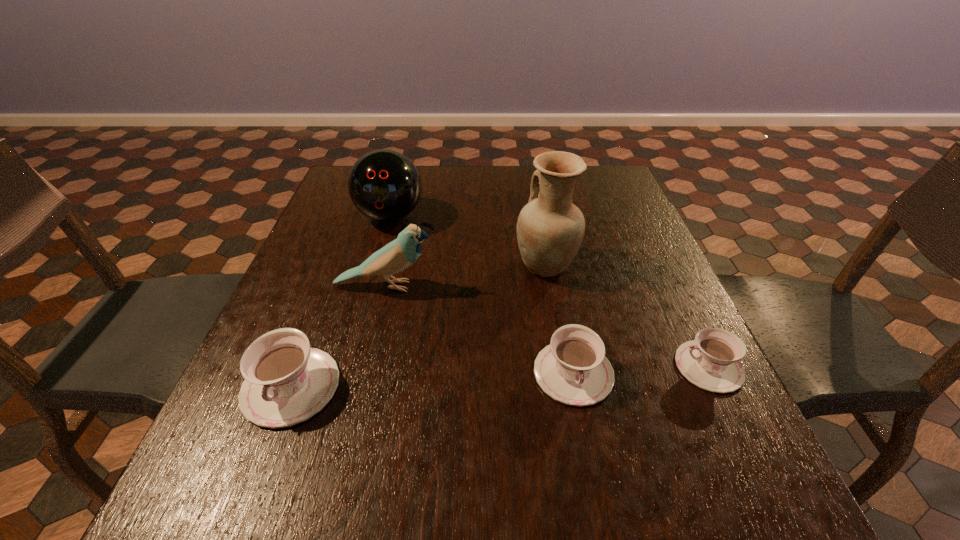
Image resolution: width=960 pixels, height=540 pixels. Find the location of `vacant space that's between the pottery and the second teacup from right to left`. vacant space that's between the pottery and the second teacup from right to left is located at coordinates (560, 319).

Locate an element on the screen. blank region between the shortest object and the bird is located at coordinates (547, 326).

The width and height of the screenshot is (960, 540). I want to click on free space between the second tallest teacup and the pottery, so click(x=560, y=319).

This screenshot has height=540, width=960. Find the location of `free space between the leftmost teacup and the bowling ball`. free space between the leftmost teacup and the bowling ball is located at coordinates (341, 301).

Identify the location of object identified as the closest to the tallest object. This screenshot has height=540, width=960. (573, 369).

Identify which object is the fifth closest to the second teacup from left to right. Please provide its 2D coordinates. Your answer should be formatted as a tuple, i.e. [(x, y)], where the tuple contains the x and y coordinates of a point satisfying the conditions above.

[(384, 185)]

In order to click on teacup identified as the second closest to the second shortest teacup in this screenshot , I will do (x=286, y=382).

Select which teacup is the second closest to the fifth tallest object. Please provide its 2D coordinates. Your answer should be formatted as a tuple, i.e. [(x, y)], where the tuple contains the x and y coordinates of a point satisfying the conditions above.

[(286, 382)]